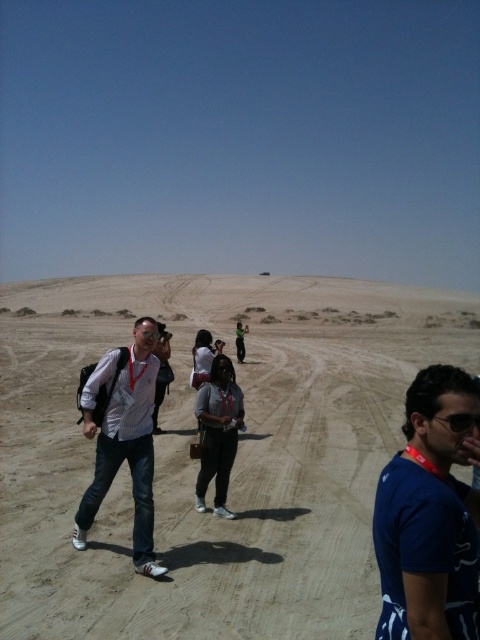
From the picture: Is white shirt at center thinner than matte gray shirt at center?

Incorrect, white shirt at center's width is not less than matte gray shirt at center's.

Between point (135, 566) and point (216, 481), which one is positioned behind?

The point (216, 481) is more distant.

Where is `white shirt at center`? The image size is (480, 640). white shirt at center is located at coordinates (121, 436).

Who is positioned more to the right, matte gray shirt at center or black plastic goggles at center?

Positioned to the right is black plastic goggles at center.

Between matte gray shirt at center and black plastic goggles at center, which one appears on the left side from the viewer's perspective?

matte gray shirt at center is more to the left.

Does point (231, 458) come closer to viewer compared to point (450, 428)?

No, (231, 458) is behind (450, 428).

The image size is (480, 640). I want to click on matte gray shirt at center, so click(x=217, y=433).

Does brown sandy dirt track at center appear on the right side of black plastic goggles at center?

Yes, brown sandy dirt track at center is to the right of black plastic goggles at center.

Based on the photo, does brown sandy dirt track at center appear on the left side of black plastic goggles at center?

In fact, brown sandy dirt track at center is to the right of black plastic goggles at center.

Is point (286, 413) less distant than point (477, 424)?

No.

Where is `brown sandy dirt track at center`? Image resolution: width=480 pixels, height=640 pixels. brown sandy dirt track at center is located at coordinates (197, 465).